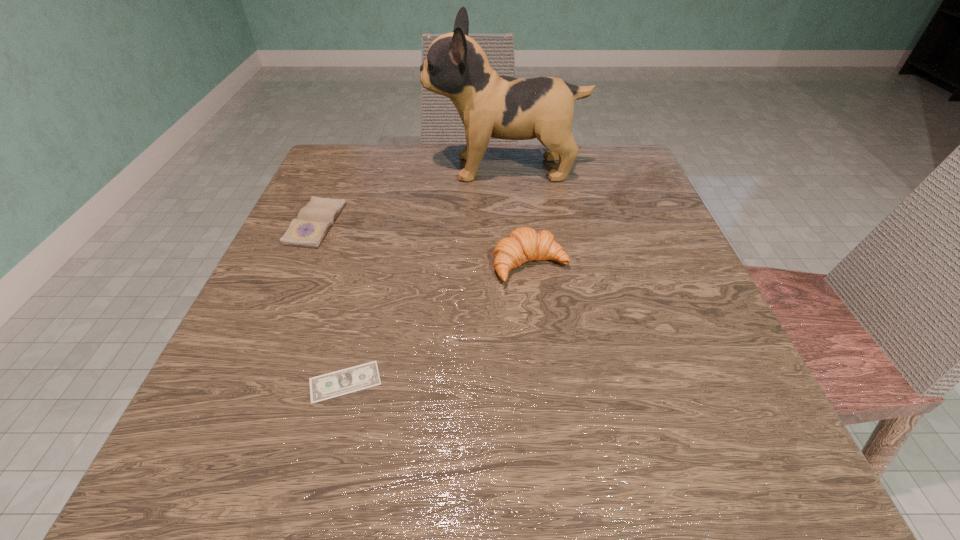
Where is `vacant space situated 0.250m on the left of the crescent roll`? vacant space situated 0.250m on the left of the crescent roll is located at coordinates (351, 265).

Identify the location of free space located on the right of the leftmost object. click(371, 224).

The height and width of the screenshot is (540, 960). In order to click on vacant area situated 0.350m on the back of the shortest object in this screenshot , I will do `click(387, 216)`.

The height and width of the screenshot is (540, 960). I want to click on object located in the far edge section of the desktop, so (x=490, y=105).

Locate an element on the screen. This screenshot has height=540, width=960. diary that is at the left edge is located at coordinates (308, 230).

Locate an element on the screen. This screenshot has width=960, height=540. money situated at the left edge is located at coordinates (357, 378).

I want to click on object that is at the right edge, so click(490, 105).

Where is `object located in the far right corner section of the desktop`? The height and width of the screenshot is (540, 960). object located in the far right corner section of the desktop is located at coordinates (490, 105).

Identify the location of vacant space at the far edge of the desktop. click(x=459, y=167).

At what (x,y) coordinates should I click in order to perform the action: click on free space at the left edge. Please return your answer as a coordinate pair (x, y). This screenshot has width=960, height=540. Looking at the image, I should click on (319, 273).